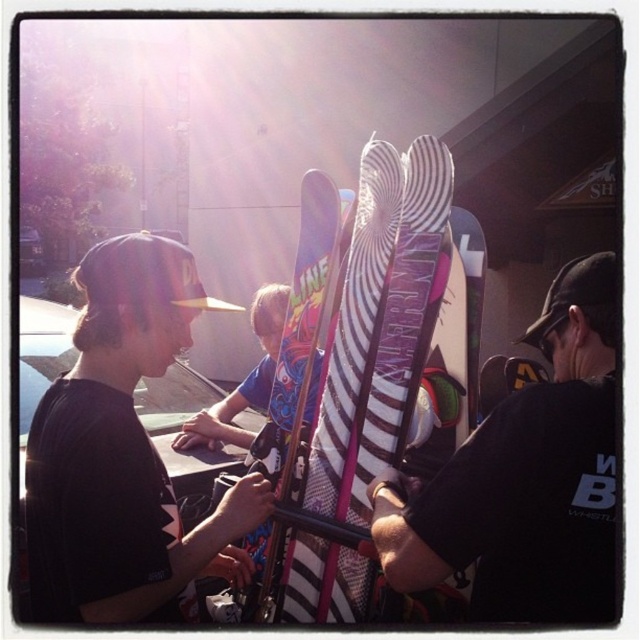
Can you confirm if black matte cap at left is positioned below multicolored striped ski at center?

Correct, black matte cap at left is located below multicolored striped ski at center.

Can you confirm if black matte cap at left is positioned to the right of multicolored striped ski at center?

In fact, black matte cap at left is to the left of multicolored striped ski at center.

You are a GUI agent. You are given a task and a screenshot of the screen. Output one action in this format:
    pyautogui.click(x=<x>, y=<y>)
    Task: Click on the black matte cap at left
    This screenshot has height=640, width=640.
    Given the screenshot: What is the action you would take?
    pyautogui.click(x=124, y=451)

Between matte black t-shirt at center and multicolored striped ski at center, which one appears on the right side from the viewer's perspective?

From the viewer's perspective, matte black t-shirt at center appears more on the right side.

Between matte black t-shirt at center and multicolored striped ski at center, which one has less height?

matte black t-shirt at center is shorter.

Does point (513, 588) come behind point (348, 275)?

No, it is not.

Find the location of a particular element. Image resolution: width=640 pixels, height=640 pixels. matte black t-shirt at center is located at coordinates (525, 477).

Is black matte cap at left to the right of matte black t-shirt at center from the viewer's perspective?

In fact, black matte cap at left is to the left of matte black t-shirt at center.

Is black matte cap at left to the left of matte black t-shirt at center from the viewer's perspective?

Indeed, black matte cap at left is positioned on the left side of matte black t-shirt at center.

The image size is (640, 640). Identify the location of black matte cap at left. (124, 451).

The width and height of the screenshot is (640, 640). I want to click on black matte cap at left, so click(x=124, y=451).